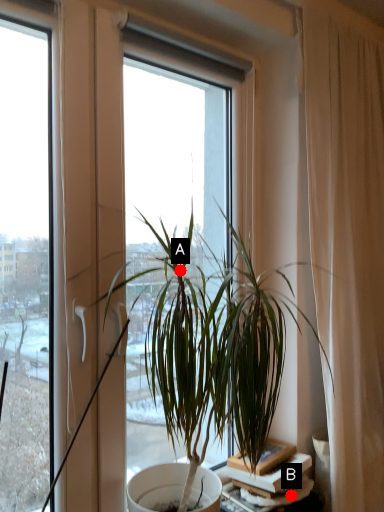
Question: Two points are circled on the image, labeled by A and B beside each circle. Among these points, which one is nearest to the camera?

Choices:
 (A) A is closer
 (B) B is closer

Answer: (A)